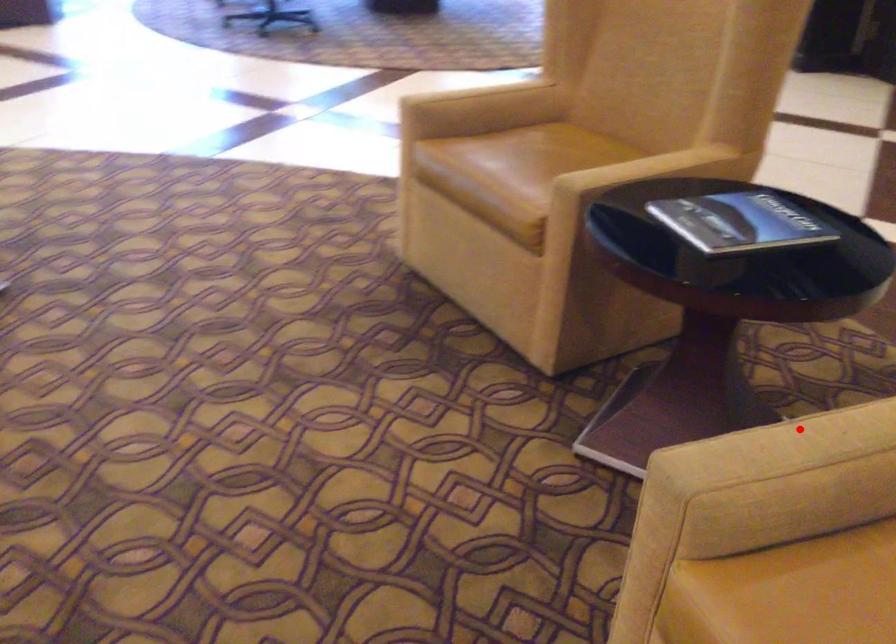
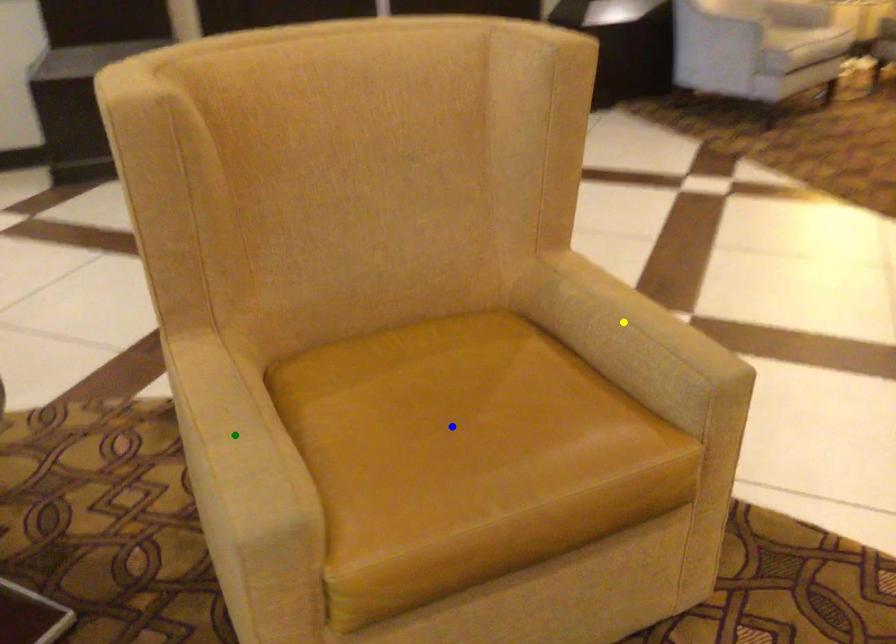
Question: I am providing you with two images of the same scene from different viewpoints. A red point is marked on the first image. You are given multiple points on the second image. Can you choose the point in image 2 that corresponds to the point in image 1?

Choices:
 (A) yellow point
 (B) blue point
 (C) green point

Answer: (C)